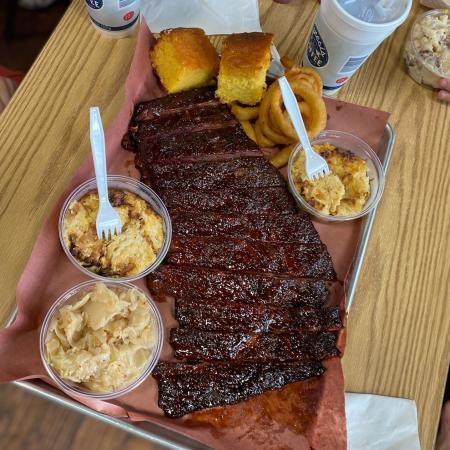
The image size is (450, 450). Identify the location of clear bowl. (90, 268).